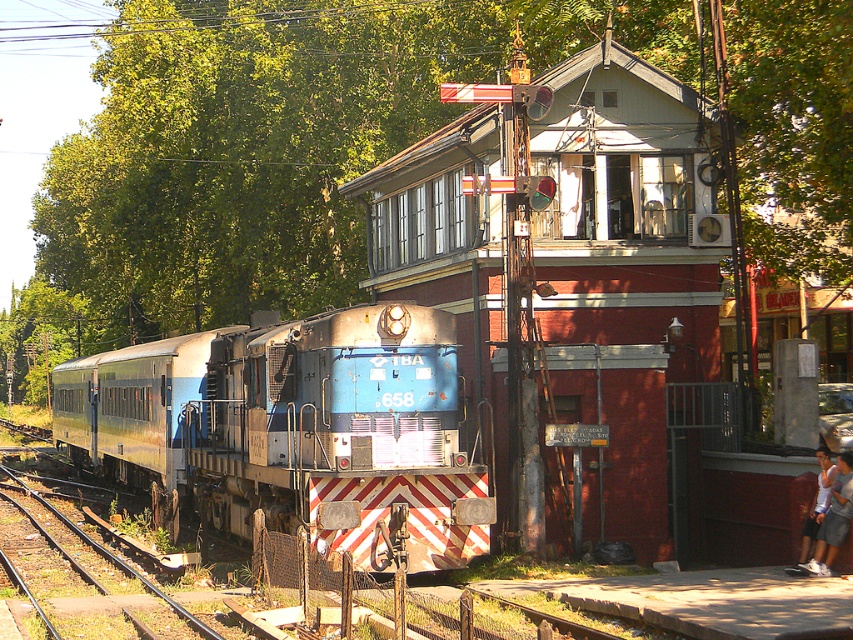
Can you confirm if rusty metal train at left is smaller than white cotton shirt at lower right?

No, rusty metal train at left is not smaller than white cotton shirt at lower right.

Identify the location of rusty metal train at left. Image resolution: width=853 pixels, height=640 pixels. (294, 429).